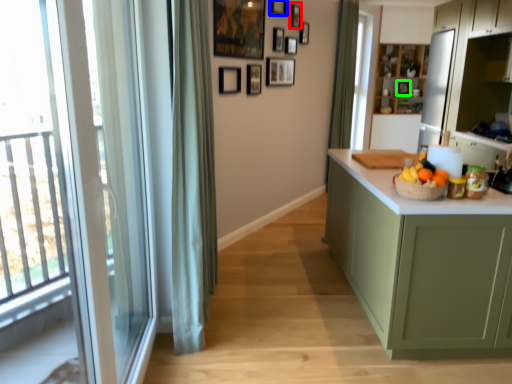
Question: Estimate the real-world distances between objects in this image. Which object is farther from picture frame (highlighted by a red box), picture frame (highlighted by a blue box) or picture frame (highlighted by a green box)?

Choices:
 (A) picture frame
 (B) picture frame

Answer: (B)